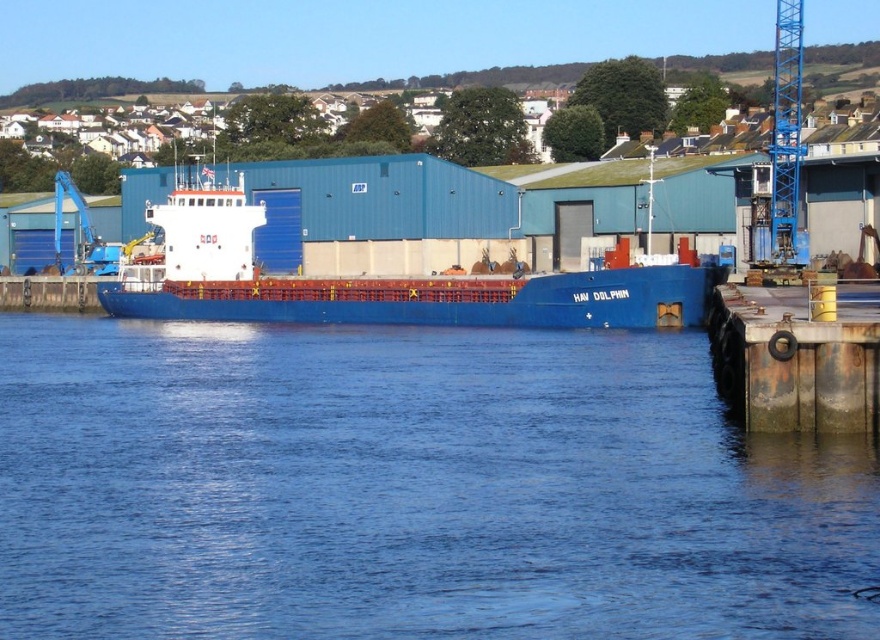
Is blue liquid water at center below blue metallic crane at upper right?

Indeed, blue liquid water at center is positioned under blue metallic crane at upper right.

Who is more forward, (436, 464) or (778, 3)?

Positioned in front is point (436, 464).

Which is behind, point (304, 602) or point (780, 260)?

Positioned behind is point (780, 260).

Find the location of a particular element. blue liquid water at center is located at coordinates (409, 488).

Describe the element at coordinates (797, 356) in the screenshot. I see `rusty metal dock at lower right` at that location.

Does point (775, 380) come behind point (776, 77)?

No.

What do you see at coordinates (797, 356) in the screenshot? This screenshot has width=880, height=640. I see `rusty metal dock at lower right` at bounding box center [797, 356].

Where is `rusty metal dock at lower right`? The height and width of the screenshot is (640, 880). rusty metal dock at lower right is located at coordinates (797, 356).

Between blue matte cargo ship at center and blue metallic crane at upper right, which one has more height?

blue metallic crane at upper right

Which is above, blue matte cargo ship at center or blue metallic crane at upper right?

blue metallic crane at upper right is above.

This screenshot has height=640, width=880. I want to click on blue matte cargo ship at center, so click(382, 280).

Where is `blue matte cargo ship at center`? This screenshot has height=640, width=880. blue matte cargo ship at center is located at coordinates (382, 280).